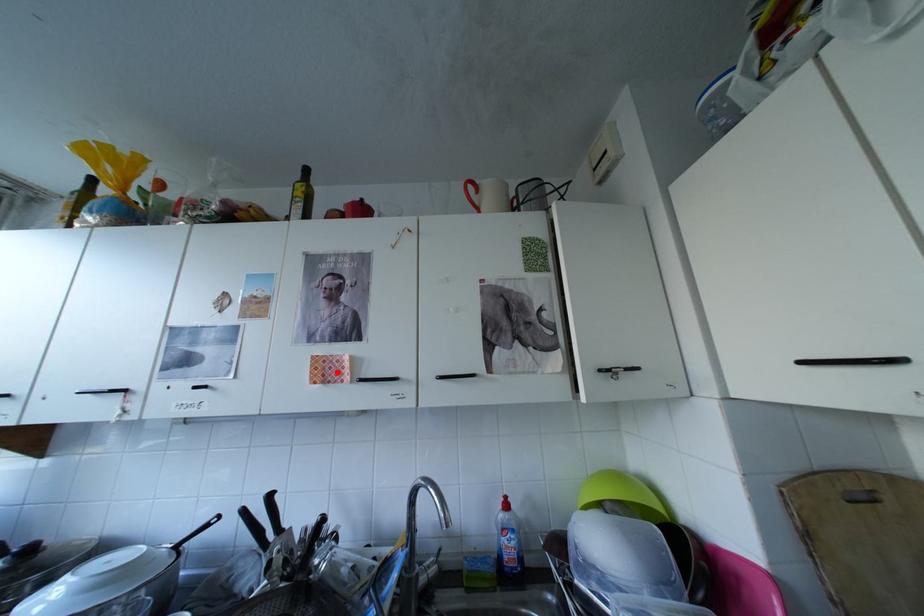
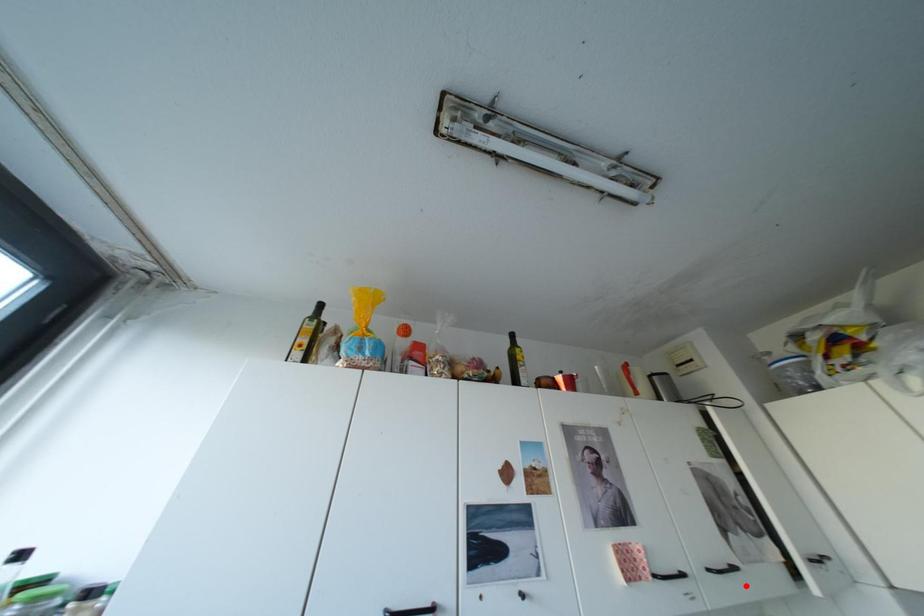
I am providing you with two images of the same scene from different viewpoints. A red point is marked on the first image and another point is marked on the second image. Do the highlighted points in image1 and image2 indicate the same real-world spot?

No